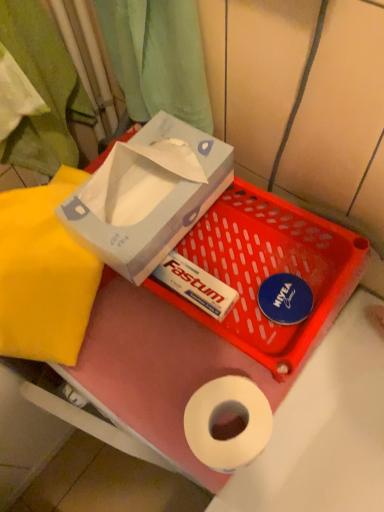
Question: Is white cardboard box at upper center, positioned as the first box in bottom-to-top order, at the right side of yellow fabric at left?

Choices:
 (A) no
 (B) yes

Answer: (B)

Question: Considering the relative sizes of white cardboard box at upper center, the second box in the top-to-bottom sequence, and yellow fabric at left in the image provided, is white cardboard box at upper center, the second box in the top-to-bottom sequence, shorter than yellow fabric at left?

Choices:
 (A) no
 (B) yes

Answer: (B)

Question: From the image's perspective, is white cardboard box at upper center, positioned as the first box in bottom-to-top order, on yellow fabric at left?

Choices:
 (A) no
 (B) yes

Answer: (A)

Question: Does white cardboard box at upper center, the second box in the top-to-bottom sequence, have a greater width compared to yellow fabric at left?

Choices:
 (A) no
 (B) yes

Answer: (B)

Question: From the image's perspective, is green fabric curtain at upper left located above or below white cardboard box at upper center, the second box in the top-to-bottom sequence?

Choices:
 (A) below
 (B) above

Answer: (B)

Question: In terms of height, does green fabric curtain at upper left look taller or shorter compared to white cardboard box at upper center, positioned as the first box in bottom-to-top order?

Choices:
 (A) tall
 (B) short

Answer: (A)

Question: Is green fabric curtain at upper left inside or outside of white cardboard box at upper center, positioned as the first box in bottom-to-top order?

Choices:
 (A) outside
 (B) inside

Answer: (A)

Question: In terms of width, does green fabric curtain at upper left look wider or thinner when compared to white cardboard box at upper center, the second box in the top-to-bottom sequence?

Choices:
 (A) thin
 (B) wide

Answer: (A)

Question: Is yellow fabric at left spatially inside green fabric curtain at upper left, or outside of it?

Choices:
 (A) inside
 (B) outside

Answer: (B)

Question: Is yellow fabric at left bigger or smaller than green fabric curtain at upper left?

Choices:
 (A) big
 (B) small

Answer: (A)

Question: From a real-world perspective, is yellow fabric at left positioned above or below green fabric curtain at upper left?

Choices:
 (A) below
 (B) above

Answer: (A)

Question: Considering their positions, is yellow fabric at left located in front of or behind green fabric curtain at upper left?

Choices:
 (A) behind
 (B) front

Answer: (A)

Question: In terms of height, does green fabric curtain at upper left look taller or shorter compared to yellow fabric at left?

Choices:
 (A) short
 (B) tall

Answer: (B)

Question: Looking at the image, does green fabric curtain at upper left seem bigger or smaller compared to yellow fabric at left?

Choices:
 (A) small
 (B) big

Answer: (A)